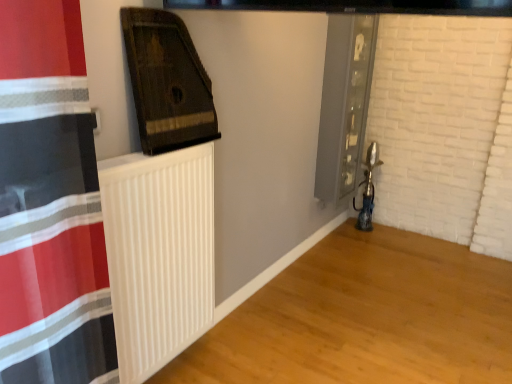
Question: From a real-world perspective, is white ribbed radiator at center under white matte radiator at lower left, the 1th wood from the bottom?

Choices:
 (A) yes
 (B) no

Answer: (B)

Question: Is white ribbed radiator at center closer to camera compared to white matte radiator at lower left, which is counted as the second wood, starting from the left?

Choices:
 (A) no
 (B) yes

Answer: (A)

Question: Considering the relative sizes of white ribbed radiator at center and white matte radiator at lower left, the 1th wood from the bottom, in the image provided, is white ribbed radiator at center wider than white matte radiator at lower left, the 1th wood from the bottom,?

Choices:
 (A) no
 (B) yes

Answer: (A)

Question: Is white ribbed radiator at center to the left of white matte radiator at lower left, the 1th wood from the bottom, from the viewer's perspective?

Choices:
 (A) yes
 (B) no

Answer: (A)

Question: Is white ribbed radiator at center positioned with its back to white matte radiator at lower left, the 1th wood from the bottom?

Choices:
 (A) yes
 (B) no

Answer: (B)

Question: From a real-world perspective, is white ribbed radiator at center positioned above or below white matte radiator at lower left, the 1th wood from the bottom?

Choices:
 (A) below
 (B) above

Answer: (B)

Question: Is white ribbed radiator at center inside or outside of white matte radiator at lower left, which ranks as the 2th wood in top-to-bottom order?

Choices:
 (A) outside
 (B) inside

Answer: (A)

Question: Based on their positions, is white ribbed radiator at center located to the left or right of white matte radiator at lower left, which ranks as the 1th wood in right-to-left order?

Choices:
 (A) left
 (B) right

Answer: (A)

Question: Is white ribbed radiator at center taller or shorter than white matte radiator at lower left, which ranks as the 1th wood in right-to-left order?

Choices:
 (A) short
 (B) tall

Answer: (B)

Question: Is white ribbed radiator at center in front of or behind dark brown wood at upper left, arranged as the 1th wood when viewed from the top, in the image?

Choices:
 (A) front
 (B) behind

Answer: (A)

Question: Is white ribbed radiator at center taller or shorter than dark brown wood at upper left, positioned as the first wood in left-to-right order?

Choices:
 (A) tall
 (B) short

Answer: (A)

Question: Considering the positions of white ribbed radiator at center and dark brown wood at upper left, positioned as the first wood in left-to-right order, in the image, is white ribbed radiator at center bigger or smaller than dark brown wood at upper left, positioned as the first wood in left-to-right order,?

Choices:
 (A) small
 (B) big

Answer: (B)

Question: Is white ribbed radiator at center to the left or to the right of dark brown wood at upper left, placed as the second wood when sorted from bottom to top, in the image?

Choices:
 (A) left
 (B) right

Answer: (A)

Question: From the image's perspective, is dark brown wood at upper left, placed as the second wood when sorted from bottom to top, above or below white matte radiator at lower left, which is counted as the second wood, starting from the left?

Choices:
 (A) below
 (B) above

Answer: (B)

Question: Considering the positions of point (188, 87) and point (501, 302), is point (188, 87) closer or farther from the camera than point (501, 302)?

Choices:
 (A) closer
 (B) farther

Answer: (A)